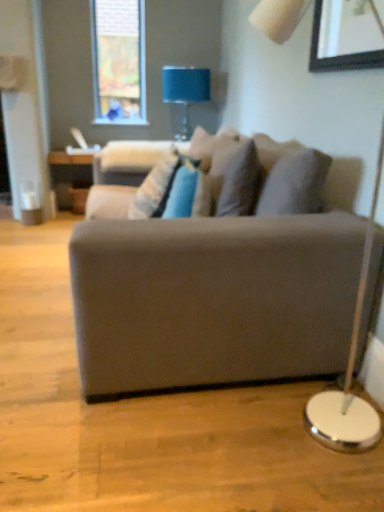
Question: Is suede gray couch at center bigger than blue fabric lampshade at upper center?

Choices:
 (A) no
 (B) yes

Answer: (B)

Question: Is suede gray couch at center completely or partially outside of blue fabric lampshade at upper center?

Choices:
 (A) yes
 (B) no

Answer: (A)

Question: From the image's perspective, would you say suede gray couch at center is shown under blue fabric lampshade at upper center?

Choices:
 (A) yes
 (B) no

Answer: (A)

Question: Does suede gray couch at center have a lesser height compared to blue fabric lampshade at upper center?

Choices:
 (A) no
 (B) yes

Answer: (A)

Question: From a real-world perspective, is suede gray couch at center positioned under blue fabric lampshade at upper center based on gravity?

Choices:
 (A) no
 (B) yes

Answer: (B)

Question: Is suede gray couch at center to the left of blue fabric lampshade at upper center from the viewer's perspective?

Choices:
 (A) yes
 (B) no

Answer: (A)

Question: From the image's perspective, is textured beige pillow at center beneath blue fabric lampshade at upper center?

Choices:
 (A) yes
 (B) no

Answer: (A)

Question: Is textured beige pillow at center facing towards blue fabric lampshade at upper center?

Choices:
 (A) yes
 (B) no

Answer: (B)

Question: Would you say textured beige pillow at center is outside blue fabric lampshade at upper center?

Choices:
 (A) no
 (B) yes

Answer: (B)

Question: Are textured beige pillow at center and blue fabric lampshade at upper center making contact?

Choices:
 (A) yes
 (B) no

Answer: (B)

Question: Does textured beige pillow at center have a greater height compared to blue fabric lampshade at upper center?

Choices:
 (A) no
 (B) yes

Answer: (A)

Question: Are textured beige pillow at center and blue fabric lampshade at upper center far apart?

Choices:
 (A) no
 (B) yes

Answer: (B)

Question: From the image's perspective, is velvet beige swivel chair at center under textured beige pillow at center?

Choices:
 (A) yes
 (B) no

Answer: (B)